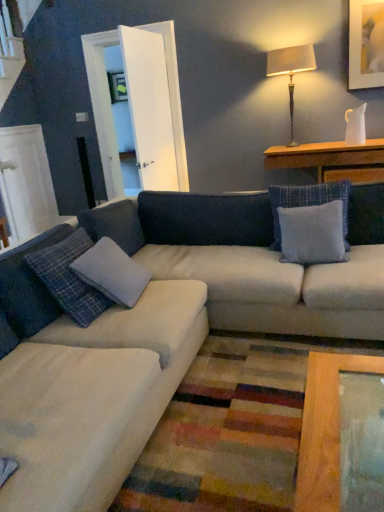
Question: Does wooden table at upper right have a larger size compared to gray fabric pillow at center, which is the second pillow in left-to-right order?

Choices:
 (A) yes
 (B) no

Answer: (A)

Question: Is wooden table at upper right further to camera compared to gray fabric pillow at center, which is the second pillow in left-to-right order?

Choices:
 (A) yes
 (B) no

Answer: (A)

Question: From the image's perspective, is wooden table at upper right below gray fabric pillow at center, marked as the first pillow in a right-to-left arrangement?

Choices:
 (A) no
 (B) yes

Answer: (A)

Question: Is wooden table at upper right next to gray fabric pillow at center, marked as the first pillow in a right-to-left arrangement, and touching it?

Choices:
 (A) no
 (B) yes

Answer: (A)

Question: From the image's perspective, is wooden table at upper right on gray fabric pillow at center, marked as the first pillow in a right-to-left arrangement?

Choices:
 (A) no
 (B) yes

Answer: (B)

Question: Is wooden table at upper right positioned before gray fabric pillow at center, which is the second pillow in left-to-right order?

Choices:
 (A) no
 (B) yes

Answer: (A)

Question: Is white fabric couch at center positioned beyond the bounds of matte gold picture frame at upper right?

Choices:
 (A) no
 (B) yes

Answer: (B)

Question: Would you say white fabric couch at center contains matte gold picture frame at upper right?

Choices:
 (A) yes
 (B) no

Answer: (B)

Question: Considering the relative positions of white fabric couch at center and matte gold picture frame at upper right in the image provided, is white fabric couch at center in front of matte gold picture frame at upper right?

Choices:
 (A) yes
 (B) no

Answer: (A)

Question: Is white fabric couch at center next to matte gold picture frame at upper right?

Choices:
 (A) yes
 (B) no

Answer: (B)

Question: Is white fabric couch at center thinner than matte gold picture frame at upper right?

Choices:
 (A) yes
 (B) no

Answer: (B)

Question: Is white fabric couch at center wider than matte gold picture frame at upper right?

Choices:
 (A) no
 (B) yes

Answer: (B)

Question: From a real-world perspective, is matte gold picture frame at upper right located beneath metallic gold table lamp at upper right?

Choices:
 (A) yes
 (B) no

Answer: (B)